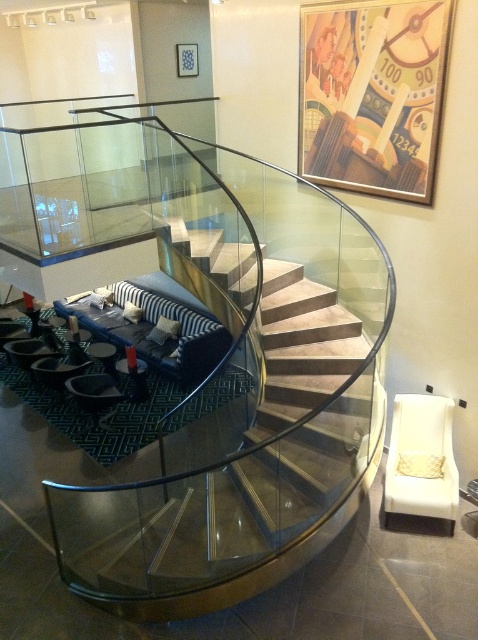
How much distance is there between clear glass staircase at center and transparent glass table at lower left?

clear glass staircase at center is 3.67 meters away from transparent glass table at lower left.

Can you confirm if clear glass staircase at center is positioned to the left of transparent glass table at lower left?

In fact, clear glass staircase at center is to the right of transparent glass table at lower left.

Is point (285, 488) closer to camera compared to point (141, 378)?

Yes, it is in front of point (141, 378).

I want to click on clear glass staircase at center, so click(238, 468).